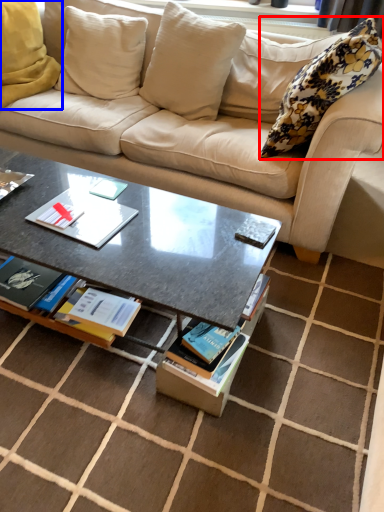
Question: Which object appears farthest to the camera in this image, pillow (highlighted by a red box) or pillow (highlighted by a blue box)?

Choices:
 (A) pillow
 (B) pillow

Answer: (B)